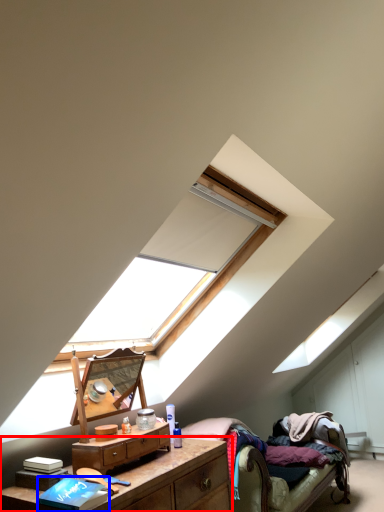
Question: Which point is further to the camera, nightstand (highlighted by a red box) or book (highlighted by a blue box)?

Choices:
 (A) nightstand
 (B) book

Answer: (B)